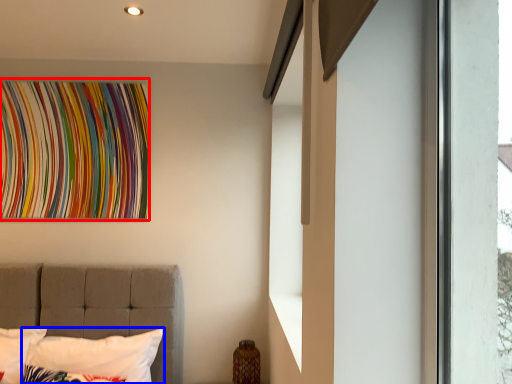
Question: Among these objects, which one is nearest to the camera, tapestry (highlighted by a red box) or pillow (highlighted by a blue box)?

Choices:
 (A) tapestry
 (B) pillow

Answer: (B)